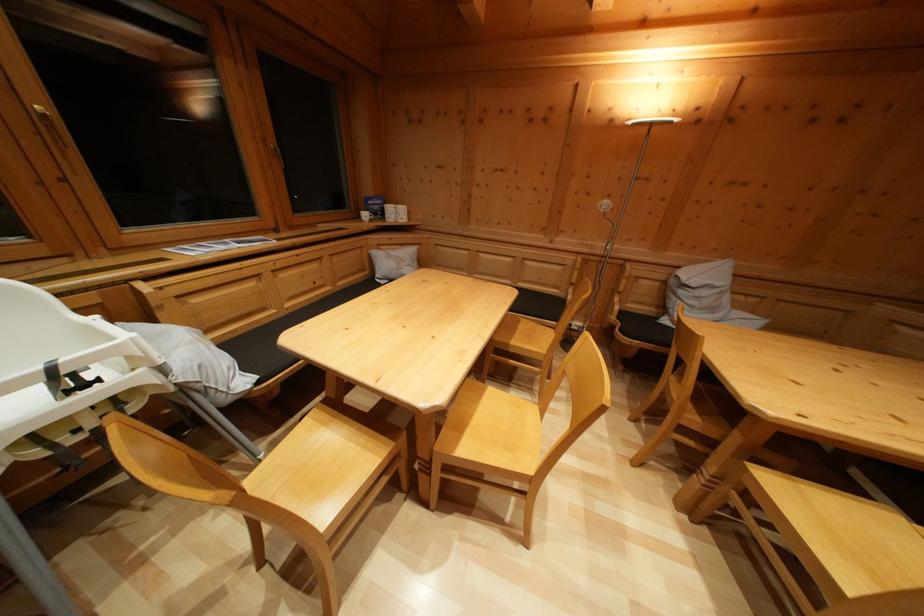
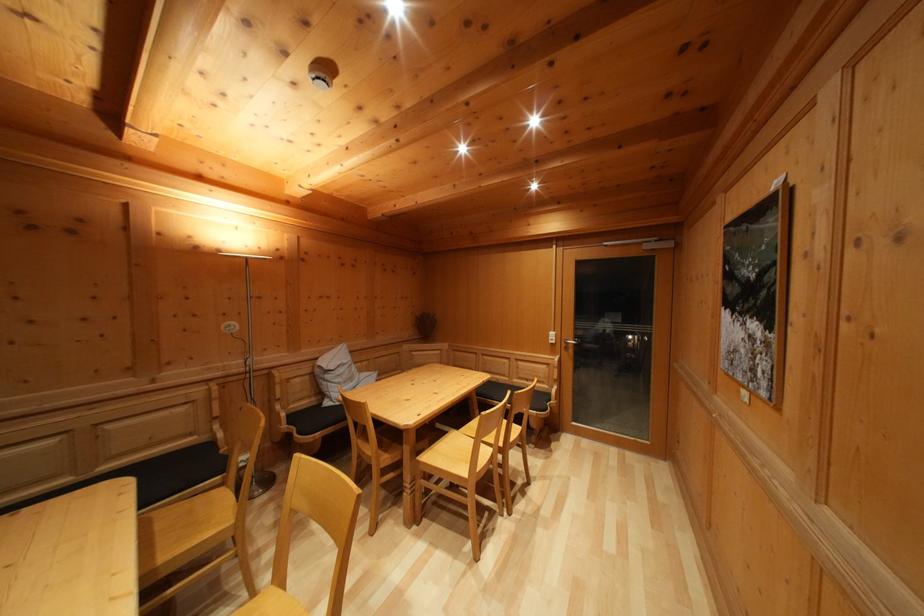
Question: The camera is either moving clockwise (left) or counter-clockwise (right) around the object. The first image is from the beginning of the video and the second image is from the end. Is the camera moving left or right when shooting the video?

Choices:
 (A) Left
 (B) Right

Answer: (A)